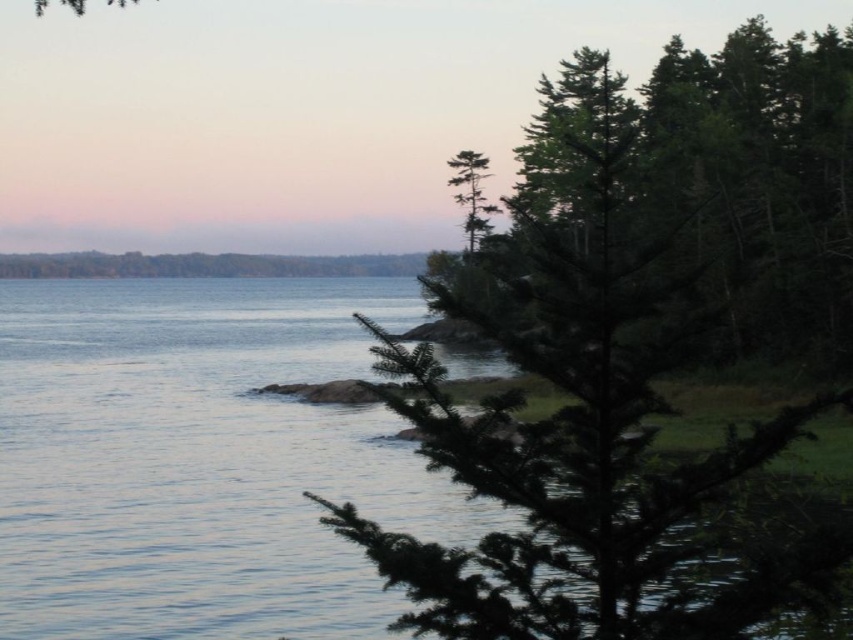
You are standing at the edge of the coastal scene and want to reach the clear water at center. Based on the coordinates provided, in which direction should you move to get there?

The clear water at center is located at coordinates point (202, 460). Since the x and y values are both positive, you should move diagonally towards the right and forward to reach it.